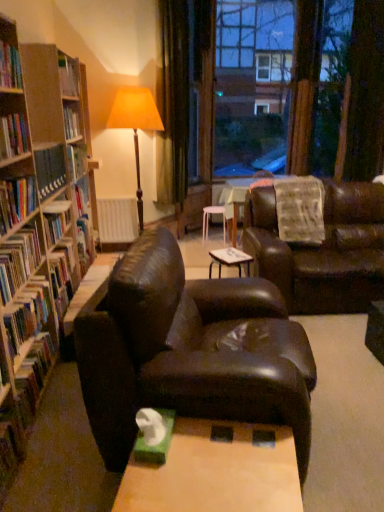
Question: Can you confirm if transparent glass window at center is shorter than hardcover book at left, acting as the 1th book starting from the top?

Choices:
 (A) no
 (B) yes

Answer: (A)

Question: Does transparent glass window at center lie behind hardcover book at left, acting as the 1th book starting from the top?

Choices:
 (A) yes
 (B) no

Answer: (A)

Question: From a real-world perspective, does transparent glass window at center stand above hardcover book at left, the sixth book when ordered from bottom to top?

Choices:
 (A) no
 (B) yes

Answer: (B)

Question: Is transparent glass window at center not within hardcover book at left, acting as the 1th book starting from the top?

Choices:
 (A) no
 (B) yes

Answer: (B)

Question: Can you confirm if transparent glass window at center is bigger than hardcover book at left, the sixth book when ordered from bottom to top?

Choices:
 (A) no
 (B) yes

Answer: (B)

Question: In the image, is matte brown floor lamp at center positioned in front of or behind white plastic stool at center?

Choices:
 (A) front
 (B) behind

Answer: (A)

Question: From the image's perspective, is matte brown floor lamp at center located above or below white plastic stool at center?

Choices:
 (A) above
 (B) below

Answer: (A)

Question: Considering the positions of point (107, 128) and point (221, 217), is point (107, 128) closer or farther from the camera than point (221, 217)?

Choices:
 (A) farther
 (B) closer

Answer: (B)

Question: Would you say matte brown floor lamp at center is to the left or to the right of white plastic stool at center in the picture?

Choices:
 (A) right
 (B) left

Answer: (B)

Question: Is green matte tissue box at lower center in front of or behind hardcover book at left, the 5th book ordered from the bottom, in the image?

Choices:
 (A) behind
 (B) front

Answer: (B)

Question: Is green matte tissue box at lower center situated inside hardcover book at left, which appears as the 2th book when viewed from the top, or outside?

Choices:
 (A) inside
 (B) outside

Answer: (B)

Question: From their relative heights in the image, would you say green matte tissue box at lower center is taller or shorter than hardcover book at left, the 5th book ordered from the bottom?

Choices:
 (A) short
 (B) tall

Answer: (A)

Question: From the image's perspective, is green matte tissue box at lower center positioned above or below hardcover book at left, which appears as the 2th book when viewed from the top?

Choices:
 (A) below
 (B) above

Answer: (A)

Question: From a real-world perspective, is matte brown floor lamp at center physically located above or below matte brown leather couch at center, which is counted as the 2th studio couch, starting from the back?

Choices:
 (A) below
 (B) above

Answer: (B)

Question: In terms of size, does matte brown floor lamp at center appear bigger or smaller than matte brown leather couch at center, the 1th studio couch from the front?

Choices:
 (A) big
 (B) small

Answer: (B)